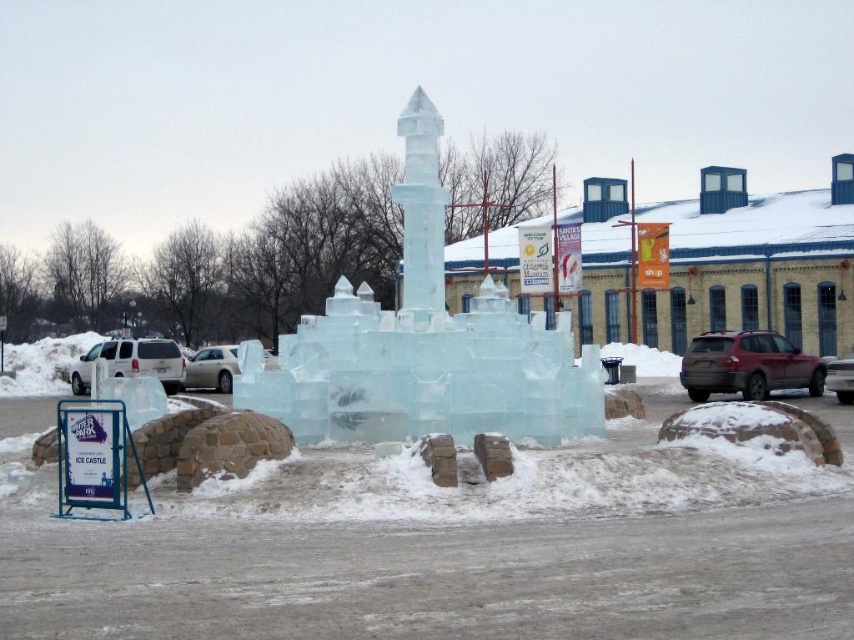
Question: Among these points, which one is farthest from the camera?

Choices:
 (A) (155, 342)
 (B) (793, 355)
 (C) (829, 387)

Answer: (A)

Question: Which object appears closest to the camera in this image?

Choices:
 (A) metallic silver suv at center
 (B) white matte car at center
 (C) matte gray suv at right
 (D) white matte suv at left

Answer: (B)

Question: Among these objects, which one is farthest from the camera?

Choices:
 (A) white matte car at center
 (B) metallic silver suv at center

Answer: (B)

Question: Can you confirm if matte gray suv at right is wider than metallic silver suv at center?

Choices:
 (A) no
 (B) yes

Answer: (A)

Question: Can you confirm if matte gray suv at right is wider than metallic silver suv at center?

Choices:
 (A) yes
 (B) no

Answer: (B)

Question: Is matte gray suv at right further to the viewer compared to metallic silver suv at center?

Choices:
 (A) no
 (B) yes

Answer: (B)